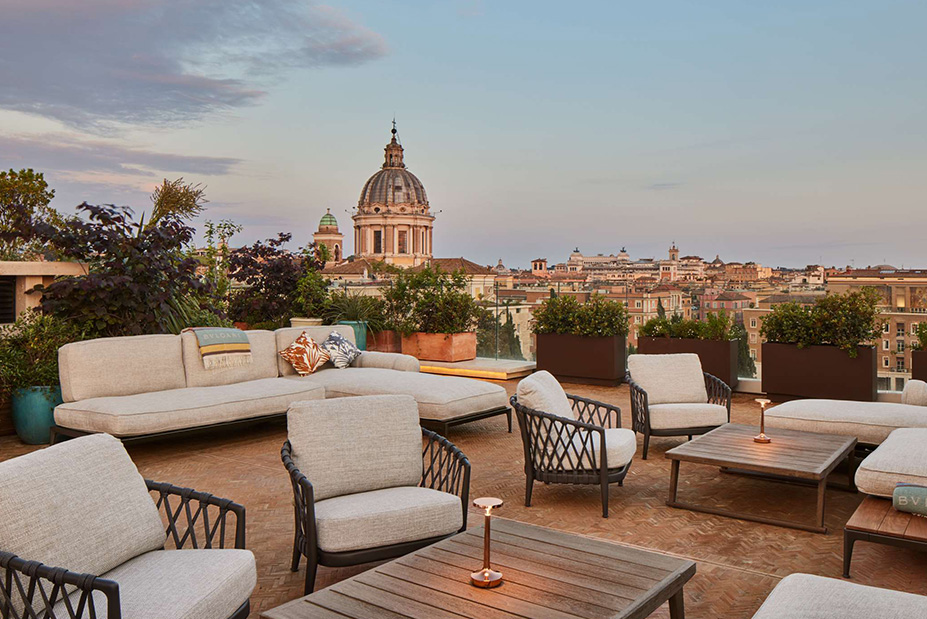
Where is `blue pot`? The image size is (927, 619). blue pot is located at coordinates (24, 405), (363, 327).